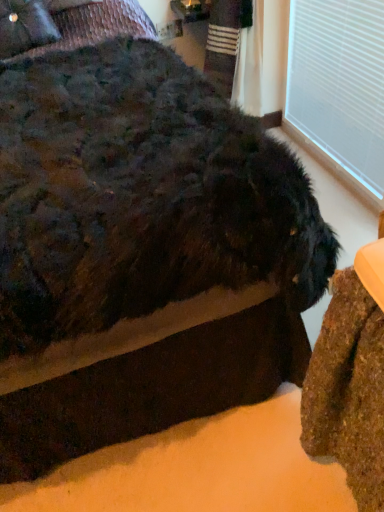
Describe the element at coordinates (339, 83) in the screenshot. I see `white plastic window frame at upper right` at that location.

What do you see at coordinates (25, 27) in the screenshot? I see `velvet-like dark brown pillow at upper left` at bounding box center [25, 27].

Find the location of a particular element. This screenshot has width=384, height=512. fuzzy black dog at center is located at coordinates (140, 195).

From a real-world perspective, which is physically above, white plastic window frame at upper right or velvet-like dark brown pillow at upper left?

From a 3D spatial view, velvet-like dark brown pillow at upper left is above.

Considering the sizes of objects white plastic window frame at upper right and velvet-like dark brown pillow at upper left in the image provided, who is smaller, white plastic window frame at upper right or velvet-like dark brown pillow at upper left?

Smaller between the two is white plastic window frame at upper right.

Is white plastic window frame at upper right facing away from velvet-like dark brown pillow at upper left?

No, white plastic window frame at upper right's orientation is not away from velvet-like dark brown pillow at upper left.

How far apart are white plastic window frame at upper right and velvet-like dark brown pillow at upper left?

white plastic window frame at upper right and velvet-like dark brown pillow at upper left are 1.19 meters apart from each other.

From a real-world perspective, does white plastic window frame at upper right sit lower than fuzzy black dog at center?

Yes, from a real-world perspective, white plastic window frame at upper right is beneath fuzzy black dog at center.

Is white plastic window frame at upper right shorter than fuzzy black dog at center?

Indeed, white plastic window frame at upper right has a lesser height compared to fuzzy black dog at center.

From the image's perspective, is white plastic window frame at upper right positioned above or below fuzzy black dog at center?

white plastic window frame at upper right is situated higher than fuzzy black dog at center in the image.

What's the angular difference between white plastic window frame at upper right and fuzzy black dog at center's facing directions?

They differ by 90 degrees in their facing directions.

Who is more distant, velvet-like dark brown pillow at upper left or white plastic window frame at upper right?

velvet-like dark brown pillow at upper left is behind.

Would you say velvet-like dark brown pillow at upper left is inside or outside white plastic window frame at upper right?

velvet-like dark brown pillow at upper left exists outside the volume of white plastic window frame at upper right.

From the image's perspective, does velvet-like dark brown pillow at upper left appear higher than white plastic window frame at upper right?

Indeed, from the image's perspective, velvet-like dark brown pillow at upper left is shown above white plastic window frame at upper right.

Between velvet-like dark brown pillow at upper left and white plastic window frame at upper right, which one has smaller width?

white plastic window frame at upper right is thinner.

From their relative heights in the image, would you say fuzzy black dog at center is taller or shorter than velvet-like dark brown pillow at upper left?

Clearly, fuzzy black dog at center is taller compared to velvet-like dark brown pillow at upper left.

Is fuzzy black dog at center at the left side of velvet-like dark brown pillow at upper left?

No, fuzzy black dog at center is not to the left of velvet-like dark brown pillow at upper left.

Which is behind, fuzzy black dog at center or velvet-like dark brown pillow at upper left?

velvet-like dark brown pillow at upper left is further from the camera.

From a real-world perspective, is fuzzy black dog at center physically above velvet-like dark brown pillow at upper left?

No.

This screenshot has width=384, height=512. Identify the location of dog below the white plastic window frame at upper right (from the image's perspective). (140, 195).

Could white plastic window frame at upper right be considered to be inside fuzzy black dog at center?

No, white plastic window frame at upper right is not surrounded by fuzzy black dog at center.

From a real-world perspective, is fuzzy black dog at center on top of white plastic window frame at upper right?

Yes.

Does velvet-like dark brown pillow at upper left lie in front of fuzzy black dog at center?

That is False.

From the image's perspective, would you say velvet-like dark brown pillow at upper left is positioned over fuzzy black dog at center?

Yes, from the image's perspective, velvet-like dark brown pillow at upper left is over fuzzy black dog at center.

This screenshot has width=384, height=512. What are the coordinates of `dog below the velvet-like dark brown pillow at upper left (from a real-world perspective)` in the screenshot? It's located at (140, 195).

From the picture: Is the surface of velvet-like dark brown pillow at upper left in direct contact with fuzzy black dog at center?

velvet-like dark brown pillow at upper left and fuzzy black dog at center are clearly separated.

Where is `pillow behind the white plastic window frame at upper right`? This screenshot has height=512, width=384. pillow behind the white plastic window frame at upper right is located at coordinates (25, 27).

Image resolution: width=384 pixels, height=512 pixels. I want to click on dog below the white plastic window frame at upper right (from the image's perspective), so point(140,195).

From the image, which object appears to be nearer to white plastic window frame at upper right, fuzzy black dog at center or velvet-like dark brown pillow at upper left?

Based on the image, fuzzy black dog at center appears to be nearer to white plastic window frame at upper right.

Estimate the real-world distances between objects in this image. Which object is closer to fuzzy black dog at center, velvet-like dark brown pillow at upper left or white plastic window frame at upper right?

velvet-like dark brown pillow at upper left.

Considering their positions, is fuzzy black dog at center positioned further to velvet-like dark brown pillow at upper left than white plastic window frame at upper right?

white plastic window frame at upper right is further to velvet-like dark brown pillow at upper left.

Based on their spatial positions, is velvet-like dark brown pillow at upper left or fuzzy black dog at center further from white plastic window frame at upper right?

velvet-like dark brown pillow at upper left.

From the image, which object appears to be nearer to fuzzy black dog at center, white plastic window frame at upper right or velvet-like dark brown pillow at upper left?

velvet-like dark brown pillow at upper left is positioned closer to the anchor fuzzy black dog at center.

Based on their spatial positions, is white plastic window frame at upper right or fuzzy black dog at center closer to velvet-like dark brown pillow at upper left?

fuzzy black dog at center is positioned closer to the anchor velvet-like dark brown pillow at upper left.

Image resolution: width=384 pixels, height=512 pixels. I want to click on dog situated between velvet-like dark brown pillow at upper left and white plastic window frame at upper right from left to right, so click(140, 195).